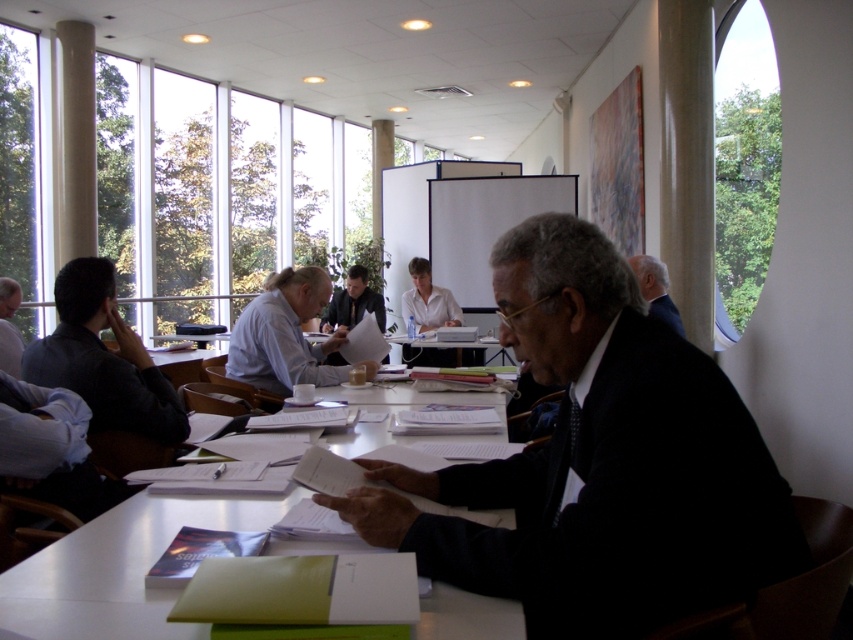
Question: Which object is closer to the camera taking this photo?

Choices:
 (A) dark blue suit at right
 (B) white glossy table at center
 (C) dark blue shirt at left

Answer: (C)

Question: Can you confirm if white paper at center is smaller than dark blue suit at right?

Choices:
 (A) yes
 (B) no

Answer: (A)

Question: Is the position of white glossy shirt at center more distant than that of dark blue shirt at center?

Choices:
 (A) yes
 (B) no

Answer: (B)

Question: Which is nearer to the matte black shirt at left?

Choices:
 (A) dark suit at center
 (B) dark blue suit at right
 (C) white glossy table at center

Answer: (A)

Question: Is white glossy shirt at center to the right of dark blue shirt at center from the viewer's perspective?

Choices:
 (A) no
 (B) yes

Answer: (B)

Question: Estimate the real-world distances between objects in this image. Which object is closer to the white paper at center?

Choices:
 (A) matte blue shirt at center
 (B) white glossy shirt at center
 (C) dark suit at center

Answer: (C)